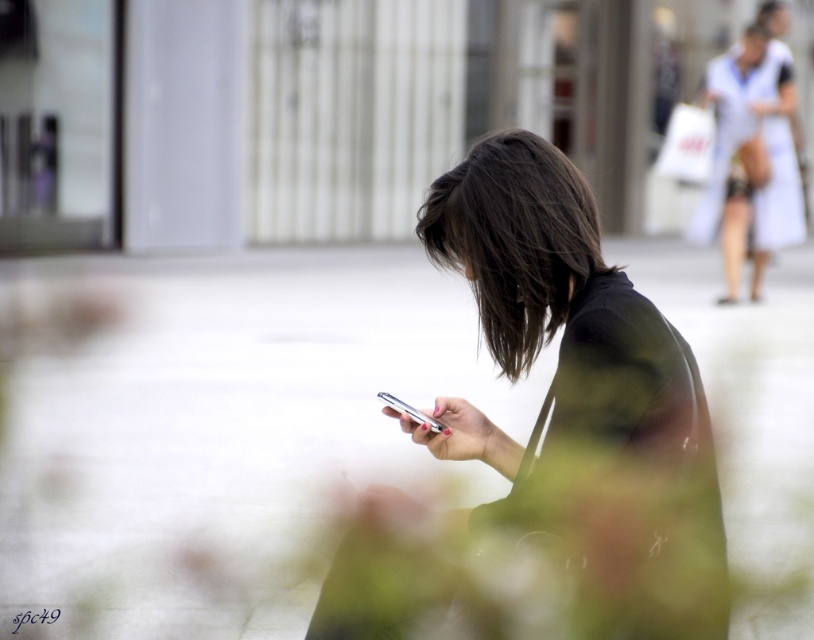
Consider the image. What is located at the coordinates point [213,422] in the image?

The point [213,422] indicates white concrete pavement at center.

What object is located at the coordinates point (559, 291) in the image?

The point (559, 291) marks the location of the matte black phone at center.

You are an urban planner analyzing the image of the plaza. The white concrete pavement at center and the matte black phone at center are both in the scene. Which object is wider?

The white concrete pavement at center is wider than the matte black phone at center.